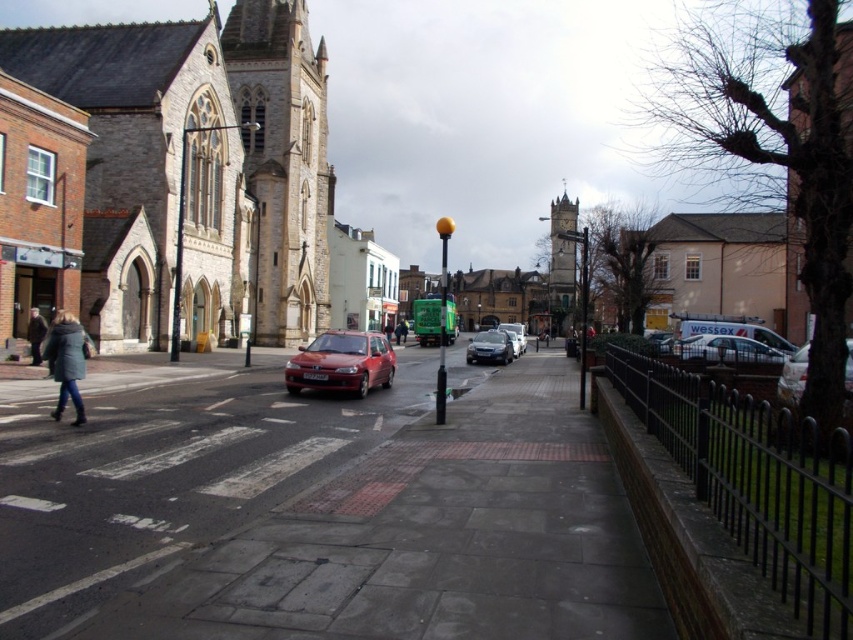
What do you see at coordinates (717, 268) in the screenshot?
I see `white matte building at center` at bounding box center [717, 268].

Can you confirm if white matte building at center is thinner than shiny red car at center?

No.

Identify the location of white matte building at center. (717, 268).

Does dark gray stone church at upper left appear under white matte building at center?

Yes.

Who is more forward, (300, 154) or (718, 280)?

Point (300, 154)

Find the location of a particular element. The width and height of the screenshot is (853, 640). dark gray stone church at upper left is located at coordinates (178, 179).

Does point (479, 458) lie in front of point (782, 365)?

Yes, point (479, 458) is in front of point (782, 365).

Between point (62, 637) and point (795, 390), which one is positioned in front?

Point (62, 637) is in front.

Who is more distant from viewer, (x=180, y=586) or (x=802, y=358)?

Point (x=802, y=358)

In order to click on gray concrete pavement at center in this screenshot , I will do pos(329,516).